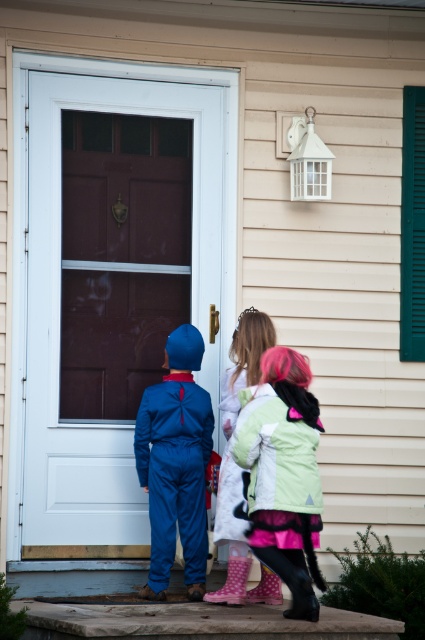
Between point (212, 301) and point (261, 394), which one is positioned in front?

Point (261, 394) is more forward.

The width and height of the screenshot is (425, 640). Find the location of `matte brown screen door at center`. matte brown screen door at center is located at coordinates (113, 282).

Can you confirm if light green fleece jacket at center is positioned to the left of blue matte jumpsuit at center?

No, light green fleece jacket at center is not to the left of blue matte jumpsuit at center.

Between point (311, 618) and point (141, 449), which one is positioned in front?

Point (311, 618)

The height and width of the screenshot is (640, 425). Identify the location of light green fleece jacket at center. (283, 474).

Who is higher up, light green fleece jacket at center or light pink polka dot boots at center?

light pink polka dot boots at center

Is point (272, 477) less distant than point (226, 440)?

Yes, point (272, 477) is closer to viewer.

Find the location of a particular element. light green fleece jacket at center is located at coordinates (283, 474).